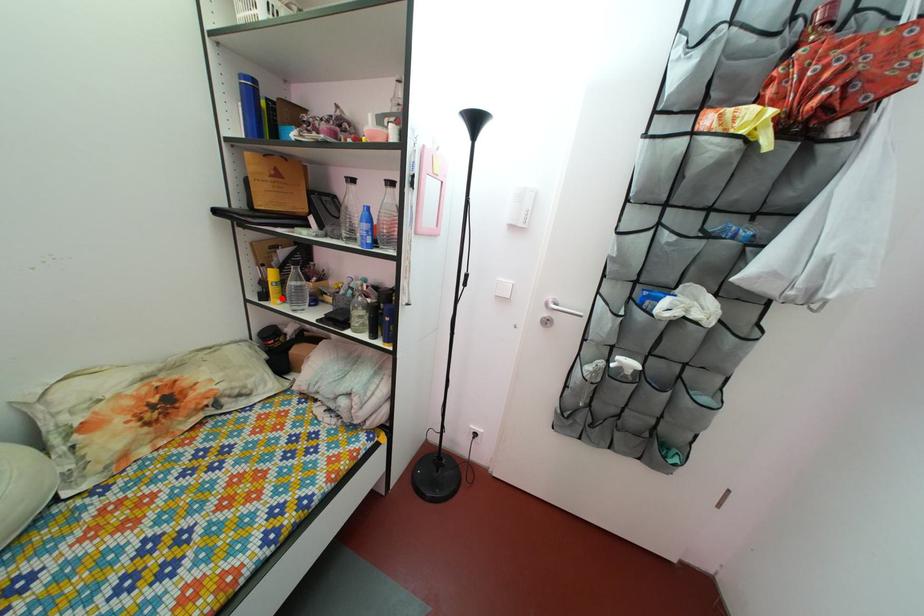
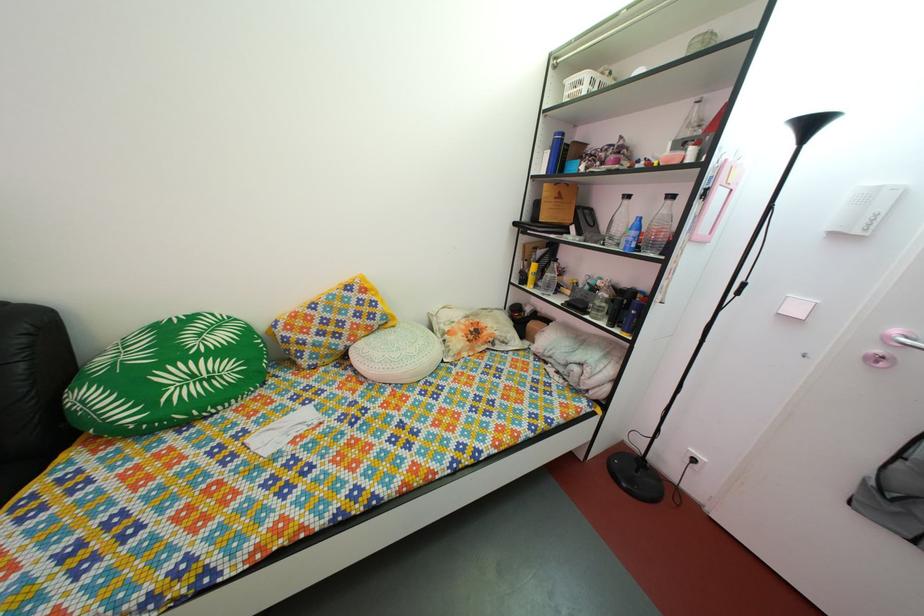
In the second image, find the point that corresponds to the highlighted location in the first image.

(540, 286)